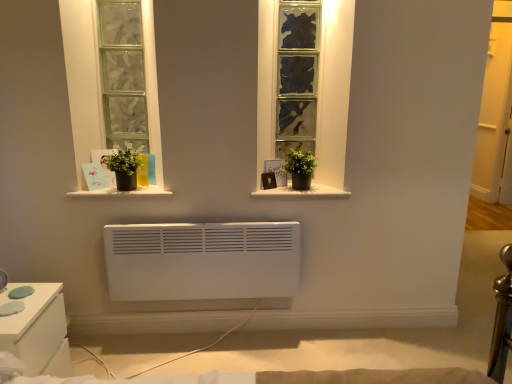
What are the coordinates of `vacant space underneath green matte plant pot at center, which is the first houseplant from right to left (from a real-world perspective)` in the screenshot? It's located at (298, 195).